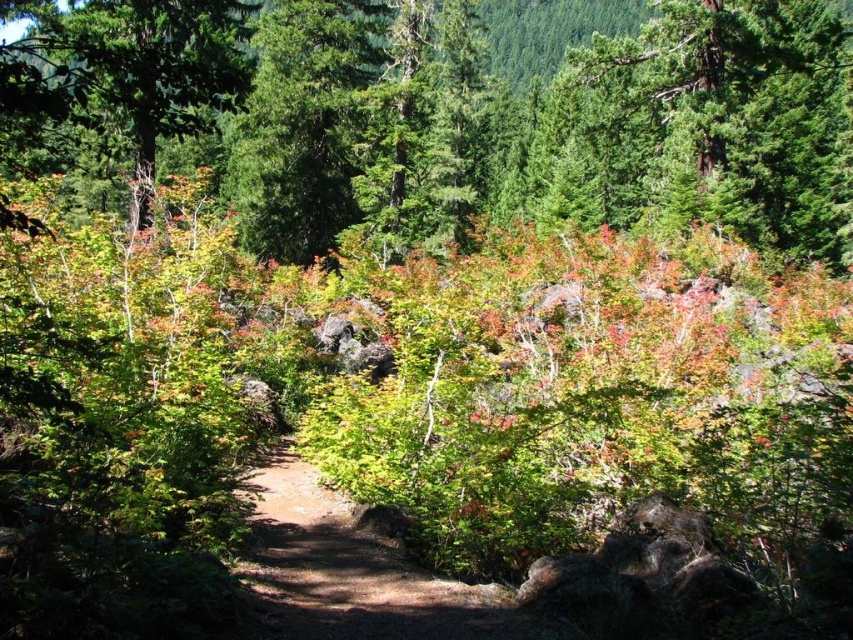
Does green matte tree at upper center lie behind dirt path at center?

No.

Does point (838, 211) lie in front of point (381, 602)?

That is False.

Identify the location of green matte tree at upper center. (498, 118).

Between point (112, 104) and point (160, 104), which one is positioned in front?

Point (160, 104)

Which is more to the left, green matte tree at upper center or green matte tree at upper left?

green matte tree at upper left is more to the left.

Describe the element at coordinates (498, 118) in the screenshot. This screenshot has width=853, height=640. I see `green matte tree at upper center` at that location.

Find the location of a particular element. This screenshot has height=640, width=853. green matte tree at upper center is located at coordinates tap(498, 118).

Who is more forward, (x=74, y=74) or (x=360, y=621)?

Point (x=74, y=74) is in front.

Does green matte tree at upper left appear on the left side of dirt path at center?

Indeed, green matte tree at upper left is positioned on the left side of dirt path at center.

This screenshot has width=853, height=640. Describe the element at coordinates (123, 72) in the screenshot. I see `green matte tree at upper left` at that location.

Where is `green matte tree at upper left`? green matte tree at upper left is located at coordinates (123, 72).